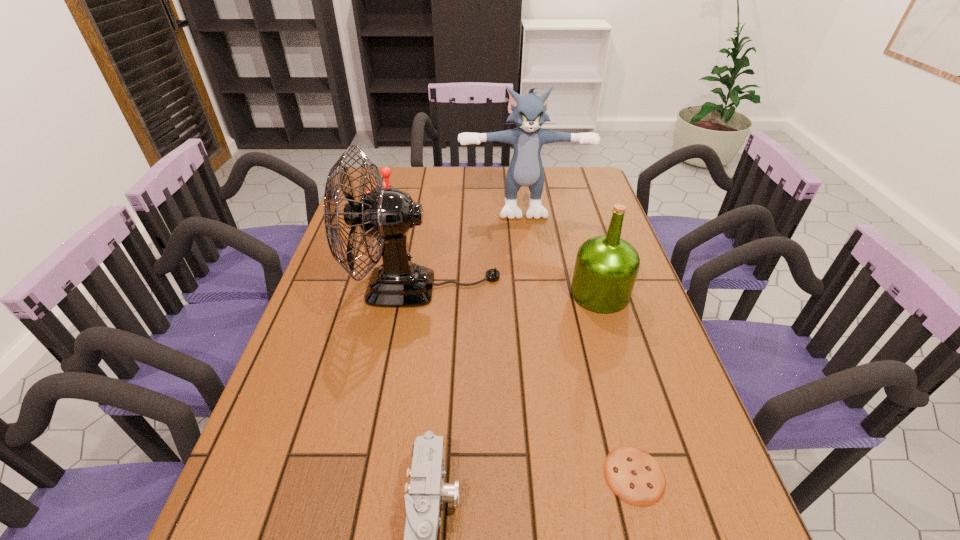
The width and height of the screenshot is (960, 540). What are the coordinates of `cat present at the far edge` in the screenshot? It's located at (529, 112).

Locate an element on the screen. The height and width of the screenshot is (540, 960). joystick located in the far edge section of the desktop is located at coordinates (385, 171).

The height and width of the screenshot is (540, 960). Find the location of `fan at the left edge`. fan at the left edge is located at coordinates (387, 215).

Where is `joystick that is at the left edge`? The image size is (960, 540). joystick that is at the left edge is located at coordinates (385, 171).

You are a GUI agent. You are given a task and a screenshot of the screen. Output one action in this format:
    pyautogui.click(x=<x>, y=<y>)
    Task: Click on the cat that is positioned at the right edge
    
    Given the screenshot: What is the action you would take?
    pyautogui.click(x=529, y=112)

The image size is (960, 540). Identify the location of olive oil that is at the right edge. (606, 267).

Identify the location of cookie present at the right edge. The width and height of the screenshot is (960, 540). (632, 474).

Find the location of `object present at the far left corner`. object present at the far left corner is located at coordinates (385, 171).

I want to click on object that is at the far right corner, so click(x=529, y=112).

Where is `free space at the far edge of the desktop`? free space at the far edge of the desktop is located at coordinates (485, 188).